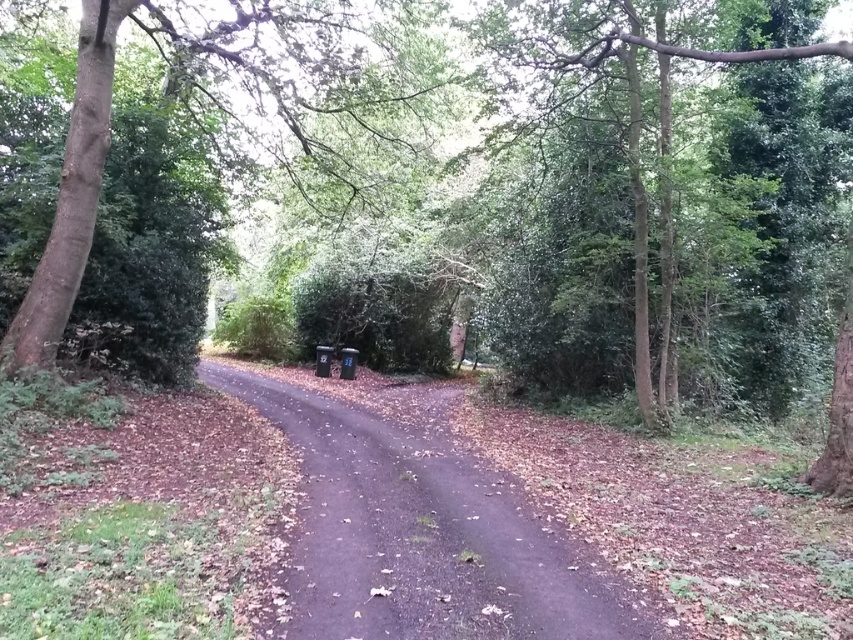
Is brown textured tree at left shorter than green leafy tree at upper center?

No.

Who is lower down, brown textured tree at left or green leafy tree at upper center?

Positioned lower is brown textured tree at left.

Does point (213, 116) come farther from viewer compared to point (563, 97)?

Yes, point (213, 116) is behind point (563, 97).

Where is `brown textured tree at left`? This screenshot has height=640, width=853. brown textured tree at left is located at coordinates (256, 156).

Does brown dirt track at center have a larger size compared to green leafy tree at upper center?

Yes, brown dirt track at center is bigger than green leafy tree at upper center.

Which is in front, point (308, 520) or point (613, 371)?

Point (308, 520) is in front.

Is point (305, 508) positioned behind point (585, 60)?

That is False.

This screenshot has height=640, width=853. Find the location of `brown dirt track at center`. brown dirt track at center is located at coordinates (421, 532).

Who is positioned more to the right, brown textured tree at left or brown dirt track at center?

brown textured tree at left is more to the right.

Locate an element on the screen. This screenshot has height=640, width=853. brown textured tree at left is located at coordinates (256, 156).

This screenshot has width=853, height=640. What are the coordinates of `brown textured tree at left` in the screenshot? It's located at (256, 156).